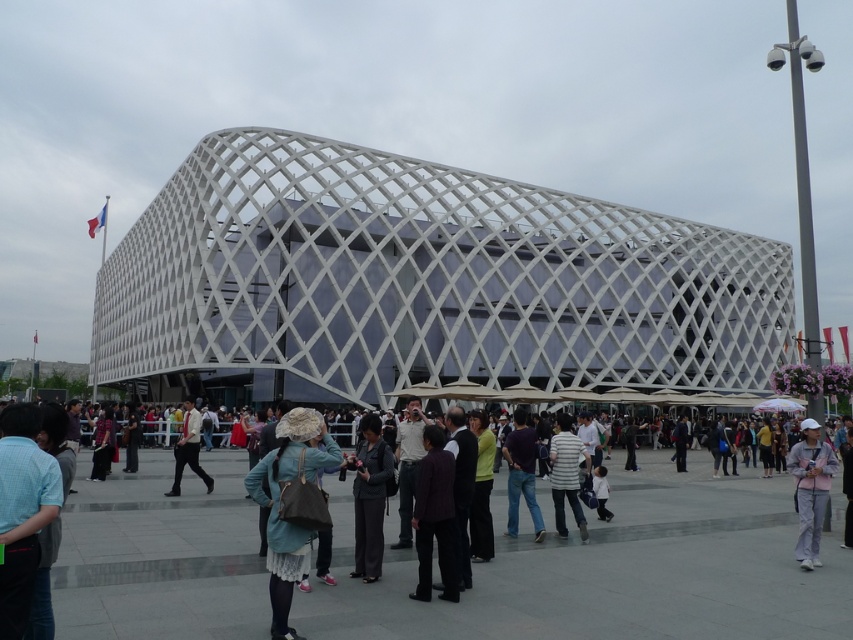
Which is behind, point (181, 266) or point (209, 477)?

Point (181, 266)

Is white lattice structure at center below light brown leather jacket at center?

No.

Between point (370, 273) and point (209, 483), which one is positioned in front?

Point (209, 483) is more forward.

Identify the location of white lattice structure at center. The image size is (853, 640). (422, 284).

Which is above, matte blue coat at center or dark purple fabric jacket at center?

dark purple fabric jacket at center is above.

Does matte blue coat at center lie behind dark purple fabric jacket at center?

No, it is in front of dark purple fabric jacket at center.

What are the coordinates of `matte blue coat at center` in the screenshot? It's located at pyautogui.click(x=279, y=506).

Who is more forward, (x=727, y=356) or (x=532, y=493)?

Point (x=532, y=493)

Between white lattice structure at center and dark purple shirt at center, which one is positioned lower?

Positioned lower is dark purple shirt at center.

The height and width of the screenshot is (640, 853). Describe the element at coordinates (422, 284) in the screenshot. I see `white lattice structure at center` at that location.

I want to click on white lattice structure at center, so click(422, 284).